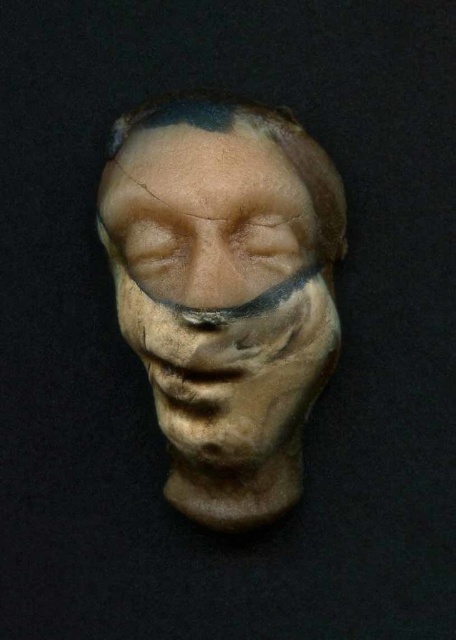
You are an art conservator examining the sculpture. You notice a specific point marked at coordinates (184, 113). Based on the sculpture description, what feature does this point likely correspond to?

The point at (184, 113) marks the brown matte eyebrow at upper center.

You are an art conservator examining the sculpture. The museum requires all displayed sculptures to be centered precisely at the point of the room. The room has a grid system where the center is at point 0.5, 0.5. Is the matte clay face at center positioned correctly for display?

The matte clay face at center is positioned at point (222, 266), which is slightly off the required center point of (228, 320). Therefore, it is not correctly positioned for display.

You are an art student analyzing a sculpture. You notice the matte clay face at center and the matte brown eye at center. Which object has a greater width?

The matte clay face at center has a greater width than the matte brown eye at center.